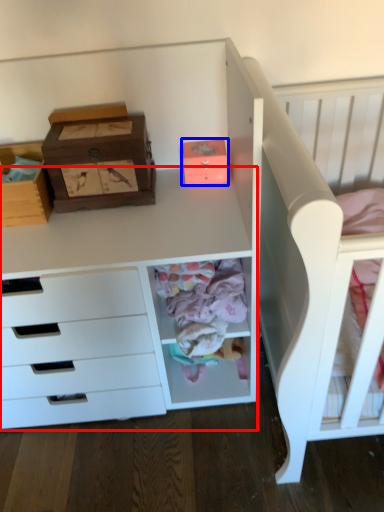
Question: Which of the following is the farthest to the observer, computer desk (highlighted by a red box) or shoe box (highlighted by a blue box)?

Choices:
 (A) computer desk
 (B) shoe box

Answer: (B)